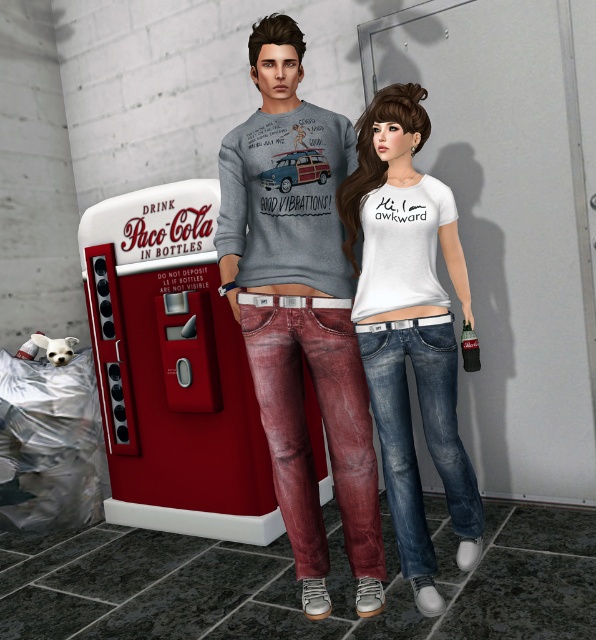
Based on the scene description, where is the metallic red vending machine at center located in terms of coordinates?

The metallic red vending machine at center is located at coordinates point [172,369].